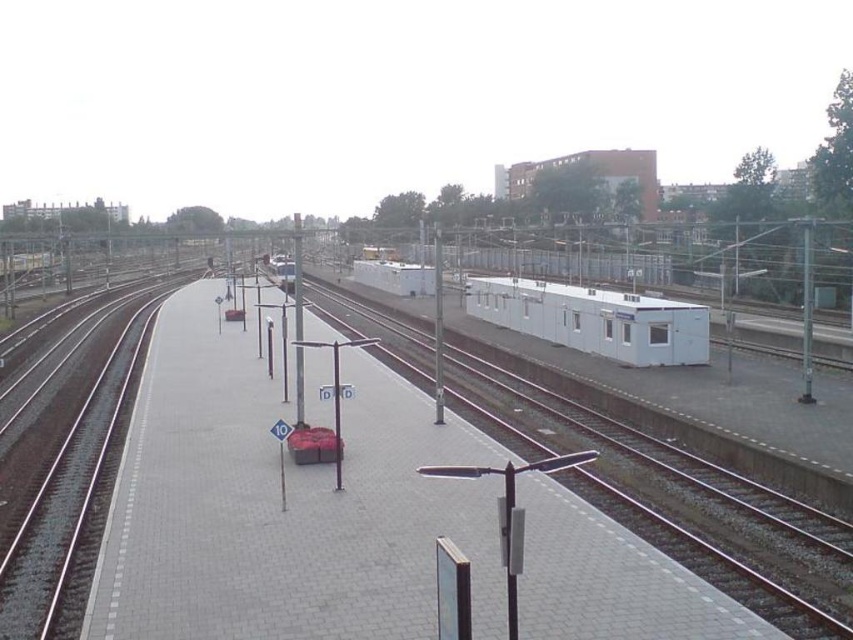
You are standing at the point marked by the coordinates point (676, 500) on the platform. What is directly beneath your feet?

The point (676, 500) indicates metal train track at center, so the metal train track at center is directly beneath your feet.

Consider the image. You are standing on the platform at the railway station. You see two points marked as point 1 at coordinate (67,532) and point 2 at coordinate (511,320). If you are facing the direction of the tracks, which point is closer to you?

Point 1 at coordinate (67,532) is closer to you because it is in front of point 2 at coordinate (511,320) when facing the tracks.